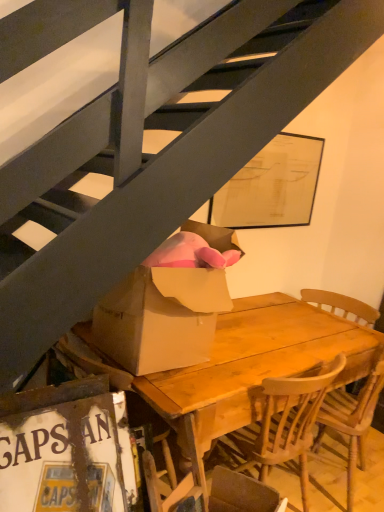
Question: From the image's perspective, would you say wooden table at center is shown under white cardboard sign at lower left?

Choices:
 (A) yes
 (B) no

Answer: (B)

Question: Is wooden table at center further to camera compared to white cardboard sign at lower left?

Choices:
 (A) no
 (B) yes

Answer: (B)

Question: From a real-world perspective, is wooden table at center located beneath white cardboard sign at lower left?

Choices:
 (A) no
 (B) yes

Answer: (B)

Question: Is wooden table at center completely or partially outside of white cardboard sign at lower left?

Choices:
 (A) no
 (B) yes

Answer: (B)

Question: Considering the relative sizes of wooden table at center and white cardboard sign at lower left in the image provided, is wooden table at center thinner than white cardboard sign at lower left?

Choices:
 (A) no
 (B) yes

Answer: (A)

Question: In terms of width, does wooden table at center look wider or thinner when compared to brown cardboard box at center?

Choices:
 (A) thin
 (B) wide

Answer: (B)

Question: Is point pos(317,336) positioned closer to the camera than point pos(213,233)?

Choices:
 (A) closer
 (B) farther

Answer: (B)

Question: From a real-world perspective, is wooden table at center above or below brown cardboard box at center?

Choices:
 (A) below
 (B) above

Answer: (A)

Question: Visually, is wooden table at center positioned to the left or to the right of brown cardboard box at center?

Choices:
 (A) left
 (B) right

Answer: (B)

Question: Is wooden chair at center spatially inside brown cardboard box at center, or outside of it?

Choices:
 (A) inside
 (B) outside

Answer: (B)

Question: Is point (360, 440) positioned closer to the camera than point (223, 239)?

Choices:
 (A) closer
 (B) farther

Answer: (B)

Question: From their relative heights in the image, would you say wooden chair at center is taller or shorter than brown cardboard box at center?

Choices:
 (A) tall
 (B) short

Answer: (A)

Question: Relative to brown cardboard box at center, is wooden chair at center in front or behind?

Choices:
 (A) front
 (B) behind

Answer: (B)

Question: Based on their positions, is white cardboard sign at lower left located to the left or right of wooden chair at center?

Choices:
 (A) right
 (B) left

Answer: (B)

Question: Looking at the image, does white cardboard sign at lower left seem bigger or smaller compared to wooden chair at center?

Choices:
 (A) big
 (B) small

Answer: (B)